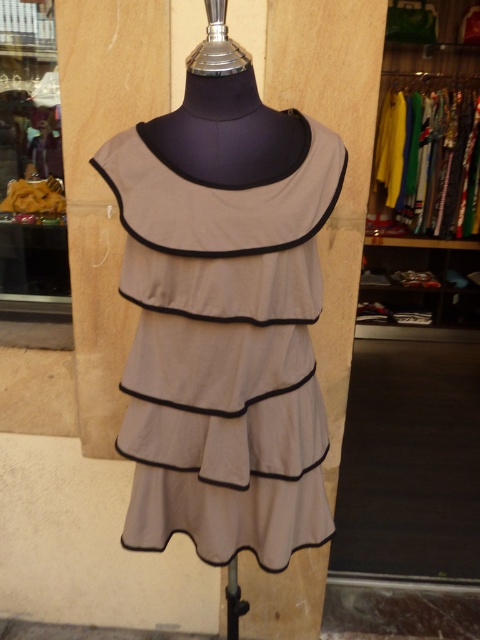
Question: Does beige cotton dress at center have a smaller size compared to matte yellow purse at left?

Choices:
 (A) yes
 (B) no

Answer: (A)

Question: Does beige cotton dress at center appear under matte yellow purse at left?

Choices:
 (A) yes
 (B) no

Answer: (A)

Question: Considering the relative positions of beige cotton dress at center and matte yellow purse at left in the image provided, where is beige cotton dress at center located with respect to matte yellow purse at left?

Choices:
 (A) right
 (B) left

Answer: (A)

Question: Which of the following is the closest to the observer?

Choices:
 (A) (294, 476)
 (B) (0, 42)

Answer: (A)